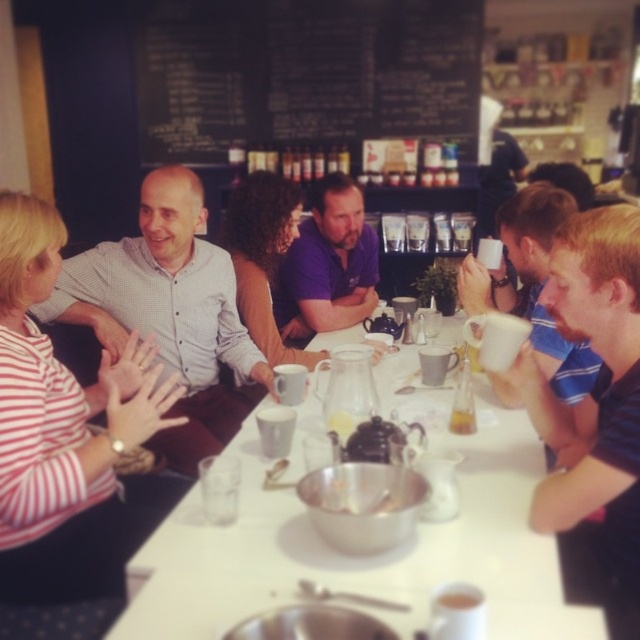
Is matte white cup at center above translucent glass cup at table center?

No, matte white cup at center is not above translucent glass cup at table center.

Is matte white cup at center further to the viewer compared to translucent glass cup at table center?

That is False.

Is point (458, 595) closer to camera compared to point (451, 413)?

Yes, point (458, 595) is closer to viewer.

At what (x,y) coordinates should I click in order to perform the action: click on matte white cup at center. Please return your answer as a coordinate pair (x, y). Image resolution: width=640 pixels, height=640 pixels. Looking at the image, I should click on (458, 600).

Is matte white shirt at center further to camera compared to purple cotton shirt at center?

That is False.

Between point (211, 298) and point (340, 240), which one is positioned in front?

Point (211, 298)

This screenshot has height=640, width=640. What are the coordinates of `matte white shirt at center` in the screenshot? It's located at (168, 310).

Is matte white shirt at center wider than matte white cup at center?

Correct, the width of matte white shirt at center exceeds that of matte white cup at center.

Can you confirm if matte white shirt at center is positioned to the right of matte white cup at center?

In fact, matte white shirt at center is to the left of matte white cup at center.

Does point (225, 273) lie in front of point (460, 600)?

No, (225, 273) is behind (460, 600).

Locate an element on the screen. This screenshot has height=640, width=640. matte white shirt at center is located at coordinates (168, 310).